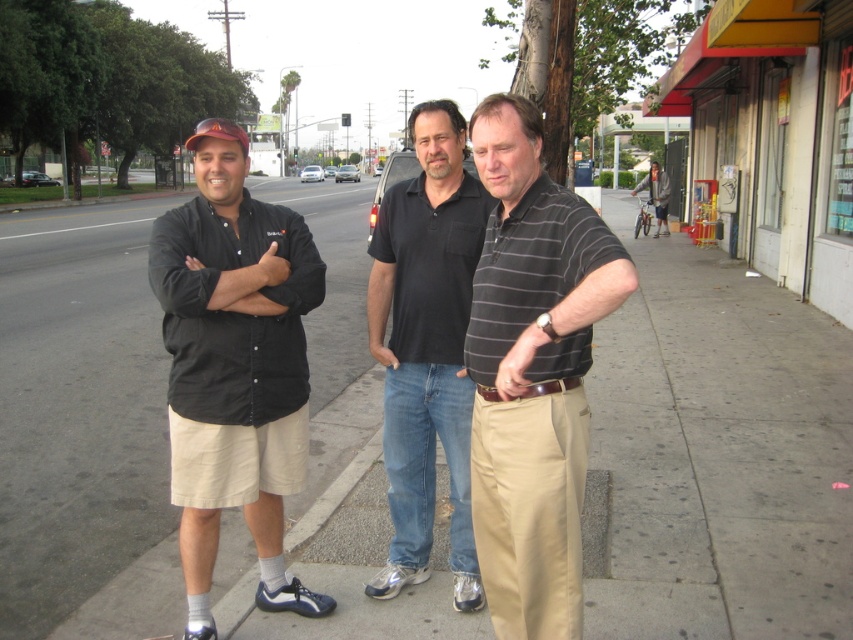
You are a photographer standing at the camera position. You want to focus on the black cotton polo shirt at center. What is the approximate coordinate where you should aim your camera?

The black cotton polo shirt at center is located at coordinate point (426,348), so you should aim your camera at that coordinate to focus on it.